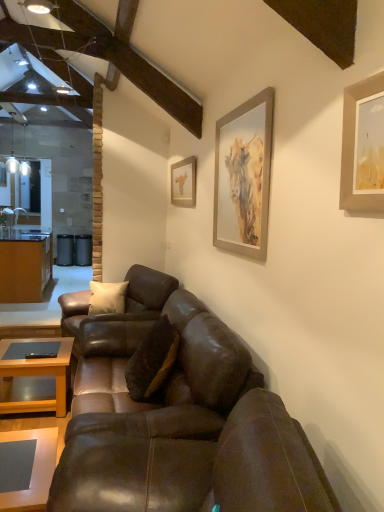
Where is `free space above matte wooden coffee table at lower left, which is the second coffee table in right-to-left order (from a real-world perspective)`? The height and width of the screenshot is (512, 384). free space above matte wooden coffee table at lower left, which is the second coffee table in right-to-left order (from a real-world perspective) is located at coordinates (29, 349).